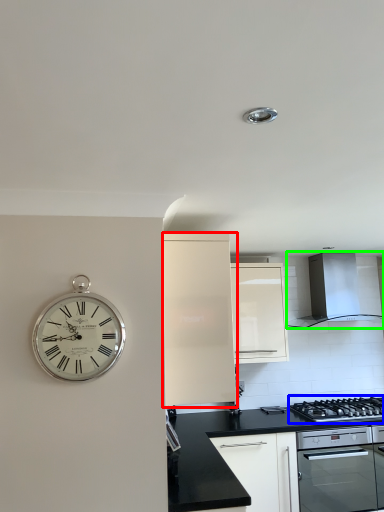
Question: Estimate the real-world distances between objects in this image. Which object is farther from cabinetry (highlighted by a red box), gas stove (highlighted by a blue box) or home appliance (highlighted by a green box)?

Choices:
 (A) gas stove
 (B) home appliance

Answer: (B)